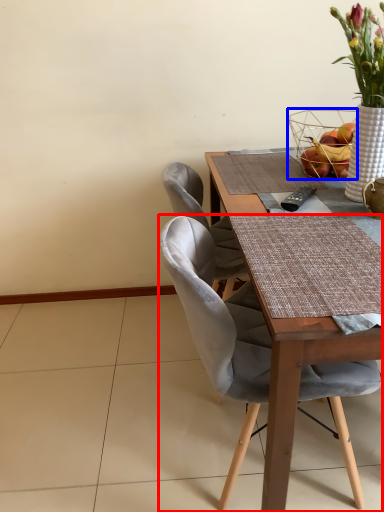
Question: Which of the following is the farthest to the observer, chair (highlighted by a red box) or basket (highlighted by a blue box)?

Choices:
 (A) chair
 (B) basket

Answer: (B)